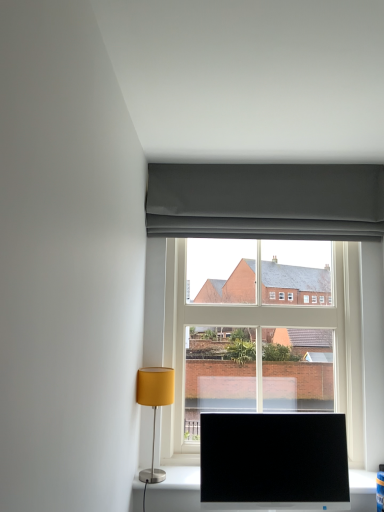
Question: From the image's perspective, does clear glass window at center appear lower than black glossy monitor at lower center?

Choices:
 (A) yes
 (B) no

Answer: (B)

Question: Does clear glass window at center have a lesser height compared to black glossy monitor at lower center?

Choices:
 (A) no
 (B) yes

Answer: (A)

Question: Is clear glass window at center surrounding black glossy monitor at lower center?

Choices:
 (A) no
 (B) yes

Answer: (A)

Question: Is clear glass window at center aimed at black glossy monitor at lower center?

Choices:
 (A) no
 (B) yes

Answer: (B)

Question: Is clear glass window at center bigger than black glossy monitor at lower center?

Choices:
 (A) no
 (B) yes

Answer: (B)

Question: Is matte yellow fabric lampshade at lower left taller or shorter than black glossy monitor at lower center?

Choices:
 (A) tall
 (B) short

Answer: (A)

Question: From the image's perspective, relative to black glossy monitor at lower center, is matte yellow fabric lampshade at lower left above or below?

Choices:
 (A) below
 (B) above

Answer: (B)

Question: Would you say matte yellow fabric lampshade at lower left is to the left or to the right of black glossy monitor at lower center in the picture?

Choices:
 (A) right
 (B) left

Answer: (B)

Question: Is point (168, 402) positioned closer to the camera than point (326, 448)?

Choices:
 (A) farther
 (B) closer

Answer: (A)

Question: Is clear glass window at center to the left or to the right of matte gray curtain at upper center in the image?

Choices:
 (A) right
 (B) left

Answer: (B)

Question: From the image's perspective, relative to matte gray curtain at upper center, is clear glass window at center above or below?

Choices:
 (A) below
 (B) above

Answer: (A)

Question: Is clear glass window at center inside or outside of matte gray curtain at upper center?

Choices:
 (A) inside
 (B) outside

Answer: (B)

Question: Is clear glass window at center taller or shorter than matte gray curtain at upper center?

Choices:
 (A) short
 (B) tall

Answer: (B)

Question: Visually, is matte gray curtain at upper center positioned to the left or to the right of matte yellow fabric lampshade at lower left?

Choices:
 (A) right
 (B) left

Answer: (A)

Question: Is point (163, 234) positioned closer to the camera than point (163, 370)?

Choices:
 (A) closer
 (B) farther

Answer: (B)